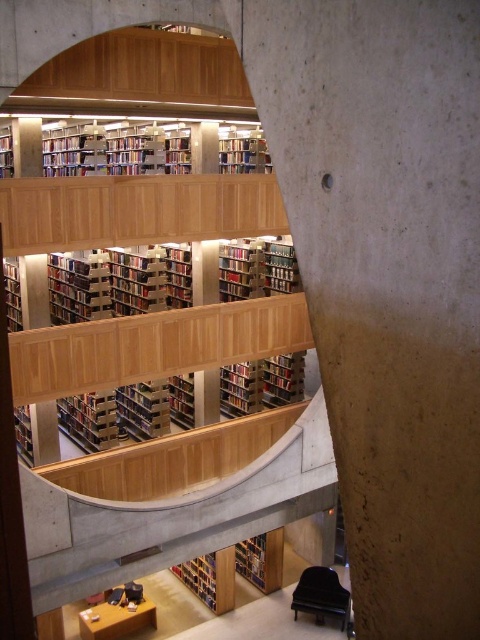
Consider the image. You are a librarian trying to organize books in the library. You have a large stack of books that need to be placed on either the wooden bookcase at upper center or the wooden bookshelf at lower center. Which one has more space to accommodate the books?

The wooden bookshelf at lower center has more space to accommodate the books because it is larger in size compared to the wooden bookcase at upper center.

You are standing in the library and want to reach the hardcover book at lower center. However, there is a wooden bookcase at upper center blocking your path. Can you walk around it to access the book?

The wooden bookcase at upper center is in front of the hardcover book at lower center, so you can walk around the bookcase to access the hardcover book at lower center.

You are a librarian trying to place a new bookshelf in the library. You have a bookshelf that is 1.2 meters wide. The wooden bookcase at upper center and the wooden bookshelf at lower center are both potential locations. Based on their widths, which one can accommodate your new bookshelf?

The wooden bookshelf at lower center has a greater width than the wooden bookcase at upper center. Since your new bookshelf is 1.2 meters wide, the wooden bookshelf at lower center is more likely to accommodate it due to its larger width.